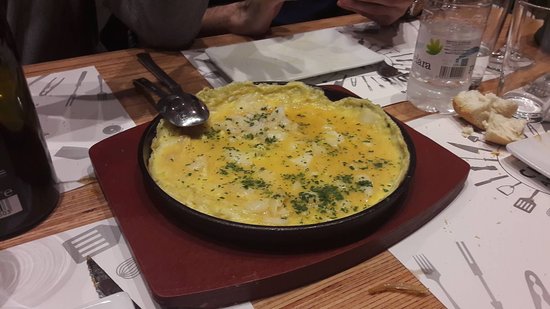
You are a GUI agent. You are given a task and a screenshot of the screen. Output one action in this format:
    pyautogui.click(x=<x>, y=<y>)
    Task: Click on the fork
    The image size is (550, 309).
    Given the screenshot: What is the action you would take?
    pyautogui.click(x=429, y=271)